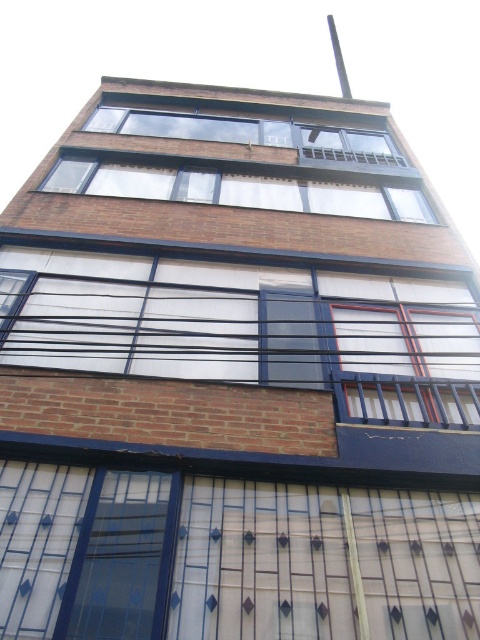
Question: Which object is farther from the camera taking this photo?

Choices:
 (A) clear glass windows at upper center
 (B) clear glass window at upper center

Answer: (B)

Question: Is white matte window at center to the right of clear glass window at upper center from the viewer's perspective?

Choices:
 (A) no
 (B) yes

Answer: (B)

Question: Among these points, which one is nearest to the camera?

Choices:
 (A) (110, 173)
 (B) (436, 332)

Answer: (B)

Question: Considering the real-world distances, which object is closest to the clear glass window at upper center?

Choices:
 (A) clear glass windows at upper center
 (B) white matte window at center

Answer: (A)

Question: Does white matte window at center appear under clear glass window at upper center?

Choices:
 (A) yes
 (B) no

Answer: (A)

Question: Does white matte window at center have a smaller size compared to clear glass window at upper center?

Choices:
 (A) yes
 (B) no

Answer: (B)